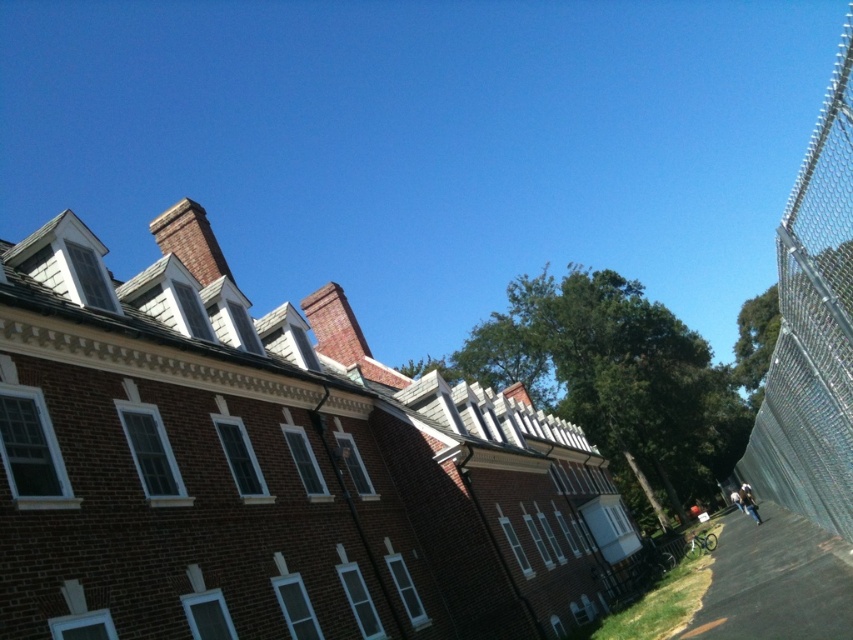
Question: Which point is farther to the camera?

Choices:
 (A) metallic chain-link fence at right
 (B) gray asphalt pavement at lower right

Answer: (B)

Question: Among these objects, which one is farthest from the camera?

Choices:
 (A) metallic chain-link fence at right
 (B) gray asphalt pavement at lower right

Answer: (B)

Question: Is metallic chain-link fence at right behind gray asphalt pavement at lower right?

Choices:
 (A) no
 (B) yes

Answer: (A)

Question: Is metallic chain-link fence at right positioned at the back of gray asphalt pavement at lower right?

Choices:
 (A) yes
 (B) no

Answer: (B)

Question: Does metallic chain-link fence at right appear over gray asphalt pavement at lower right?

Choices:
 (A) no
 (B) yes

Answer: (B)

Question: Which object appears farthest from the camera in this image?

Choices:
 (A) gray asphalt pavement at lower right
 (B) metallic chain-link fence at right

Answer: (A)